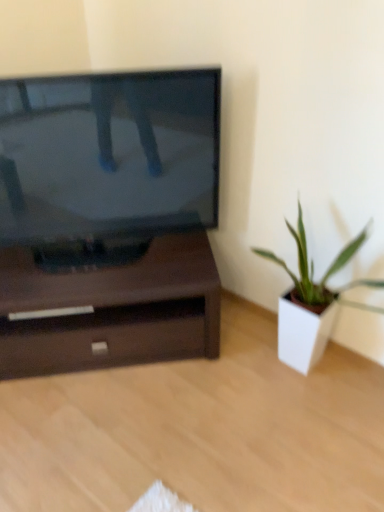
You are a GUI agent. You are given a task and a screenshot of the screen. Output one action in this format:
    pyautogui.click(x=<x>, y=<y>)
    Task: Click on the vacant space in front of green matte plant at right
    
    Given the screenshot: What is the action you would take?
    pyautogui.click(x=311, y=462)